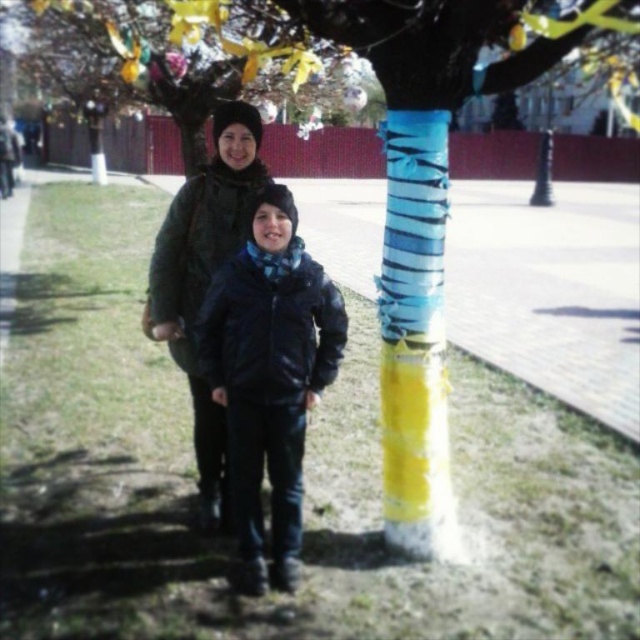
Looking at this image, you are a photographer standing in front of the scene. You need to adjust your camera focus to capture both the decorative painted tree trunk at center and the matte black jacket at center clearly. Which object should you focus on first to ensure both are in focus?

You should focus on the decorative painted tree trunk at center first because it is closer to you than the matte black jacket at center. By focusing on the closer object, the depth of field will naturally include the farther object in acceptable focus.

You are a photographer trying to capture a clear shot of both the decorative painted tree trunk at center and the glossy black jacket at center. However, the tree trunk is blocking part of the jacket. How can you adjust your position to ensure both are fully visible in the photo?

The decorative painted tree trunk at center is positioned over the glossy black jacket at center. To ensure both are fully visible, move to the side so that the tree trunk no longer overlaps with the jacket.

You are standing at point (241, 243) and want to walk to the tree with blue and yellow tape. Which direction should you move relative to point (320, 358)?

You should move towards point (320, 358) because it is in front of point (241, 243), so moving towards it would lead you closer to the tree with blue and yellow tape.